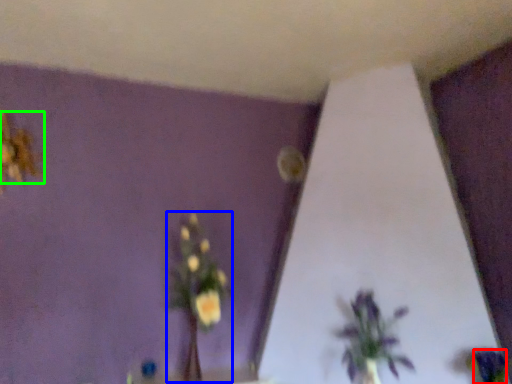
Question: Based on their relative distances, which object is nearer to flower (highlighted by a red box)? Choose from floral arrangement (highlighted by a blue box) and flower (highlighted by a green box).

Choices:
 (A) floral arrangement
 (B) flower

Answer: (A)